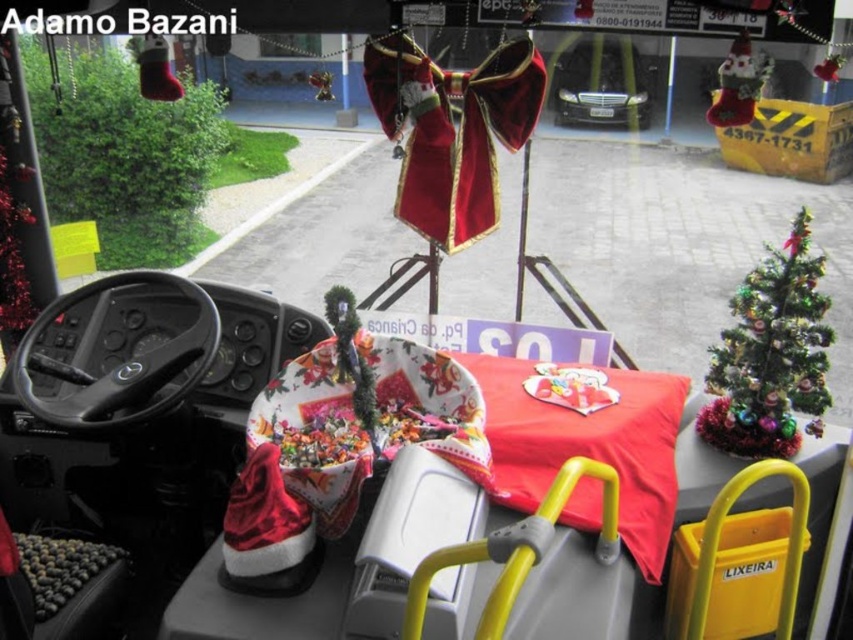
You are a passenger on a Christmas decorated bus and want to place a small gift under the green artificial christmas tree at right. However, there is a glossy black car at center in the way. Can you easily access the tree without moving the car?

The green artificial christmas tree at right is shorter than the glossy black car at center, so it might be possible to access the tree without moving the car if the height difference allows reaching around or over the car. However, the exact feasibility depends on the specific dimensions and layout not fully described here.

You are a delivery person needing to place a package between the green artificial christmas tree at right and the glossy black car at center. The package requires 5 meters of space. Is there enough space?

A: The green artificial christmas tree at right is 6.03 meters from the glossy black car at center, so yes, there is enough space to place the package between them since the distance is greater than the required 5 meters.

You are a delivery person who needs to place a large package between the green artificial christmas tree at right and the glossy black car at center. Based on their sizes, will the package fit in the space between them?

The green artificial christmas tree at right is narrower than the glossy black car at center, so the space between them may accommodate the large package depending on the exact dimensions.